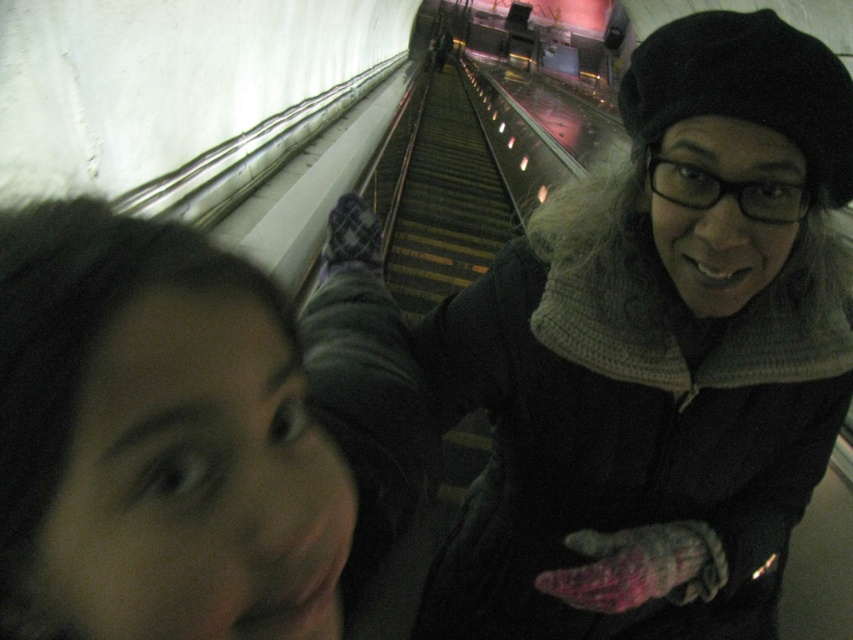
You are trying to take a selfie in a subway station. You see a knitted gray scarf at upper center. Where should you position your phone to capture the scarf in the center of the photo?

To capture the knitted gray scarf at upper center in the center of the photo, position your phone so that the scarf is aligned with the center point of your camera viewfinder at coordinates approximately 0.544 on the x axis and 0.740 on the y axis.

You are standing in a subway station and want to take a selfie with two friends. You notice two points marked in the scene. Which point is closer to you, point (380, 288) or point (363, 300)?

Point (380, 288) is closer to you than point (363, 300) because it is further to the viewer in the scene.

Based on the scene description, if you were to take a photo of the knitted gray scarf at upper center and matte black hair at upper left, which object would appear taller in the photo?

The knitted gray scarf at upper center would appear taller in the photo because it has a greater height compared to the matte black hair at upper left.